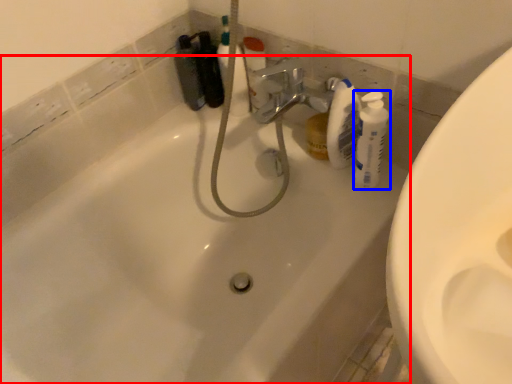
Question: Which object appears closest to the camera in this image, bathtub (highlighted by a red box) or cleaning product (highlighted by a blue box)?

Choices:
 (A) bathtub
 (B) cleaning product

Answer: (A)